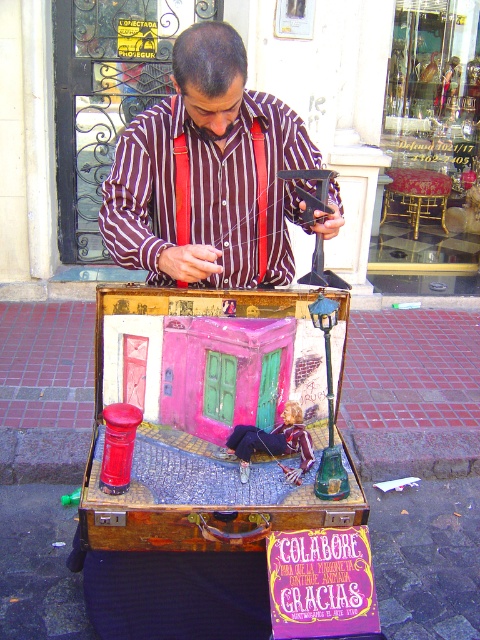
You are a street performer who is trying to place a new miniature tree in your suitcase diorama. You have two points marked as potential locations for the tree. The first point is at coordinates point(256, 266) and the second point is at coordinates point(236, 449). Which point is closer to the front of the suitcase?

Point(256, 266) is closer to the front of the suitcase because it is further to the viewer than point(236, 449).

You are a fashion designer observing the street performer. You need to decide which item would require more fabric to create between the striped cotton shirt at center and the metallic silver figure at center. Which one would need more fabric?

The striped cotton shirt at center has a greater width than the metallic silver figure at center, so it would require more fabric to create.